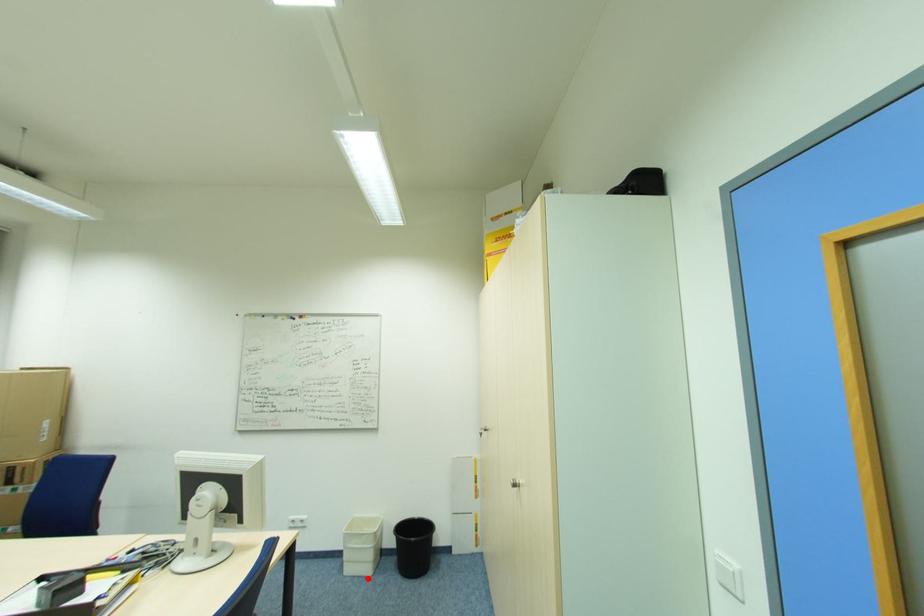
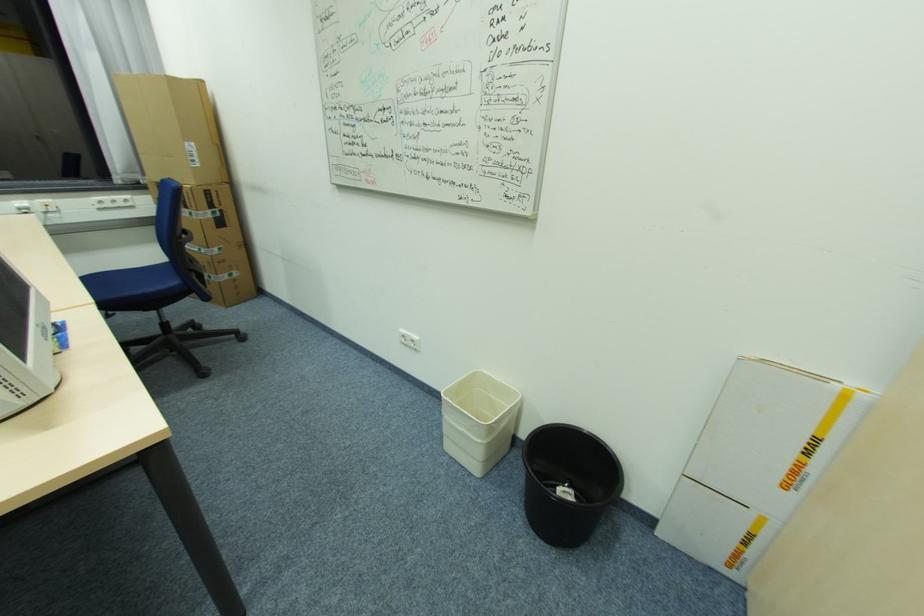
Question: I am providing you with two images of the same scene from different viewpoints. In image1, a red point is highlighted. Considering the same 3D point in image2, which of the following is correct?

Choices:
 (A) It is closer
 (B) It is farther

Answer: (B)